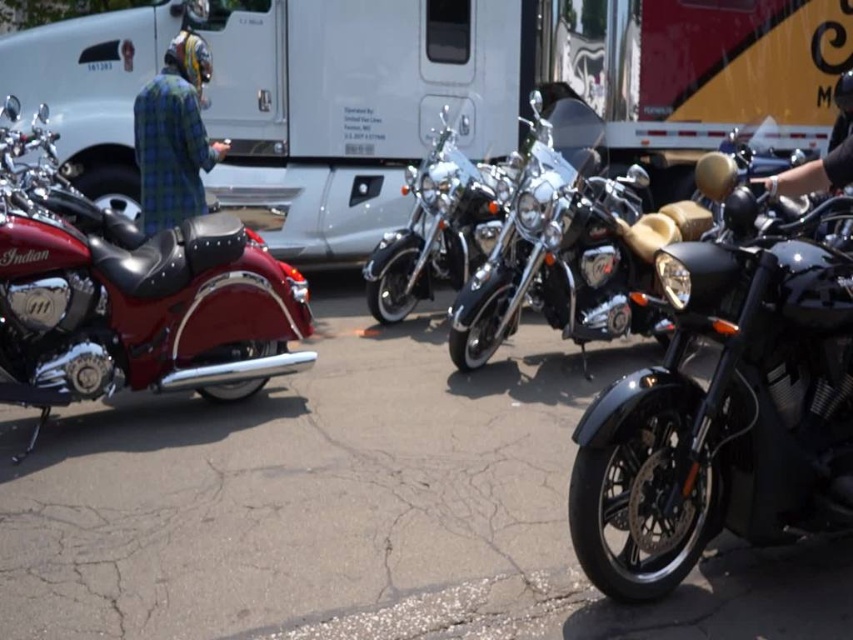
Question: Which of the following is the farthest from the observer?

Choices:
 (A) (463, 208)
 (B) (630, 184)

Answer: (B)

Question: Does shiny red leather motorcycle at left appear under plaid fabric jacket at upper left?

Choices:
 (A) no
 (B) yes

Answer: (B)

Question: Where is brushed metal trailer truck at center located in relation to polished chrome motorcycle at center in the image?

Choices:
 (A) left
 (B) right

Answer: (B)

Question: Among these objects, which one is farthest from the camera?

Choices:
 (A) shiny red leather motorcycle at left
 (B) brushed metal trailer truck at center
 (C) shiny black motorcycle at center
 (D) black leather glove at upper right

Answer: (D)

Question: Does black leather motorcycle at center appear over plaid fabric jacket at upper left?

Choices:
 (A) yes
 (B) no

Answer: (B)

Question: Which point is farther to the camera?

Choices:
 (A) click(x=769, y=182)
 (B) click(x=204, y=168)
 (C) click(x=39, y=404)

Answer: (B)